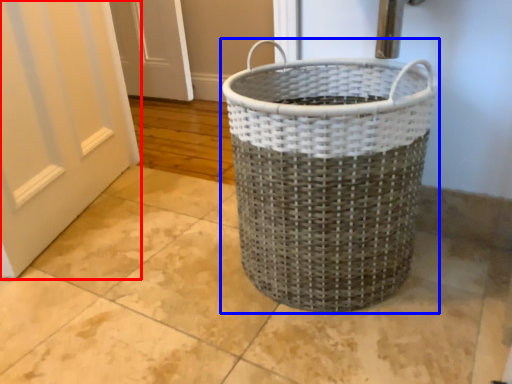
Question: Which object is further to the camera taking this photo, door (highlighted by a red box) or waste container (highlighted by a blue box)?

Choices:
 (A) door
 (B) waste container

Answer: (A)